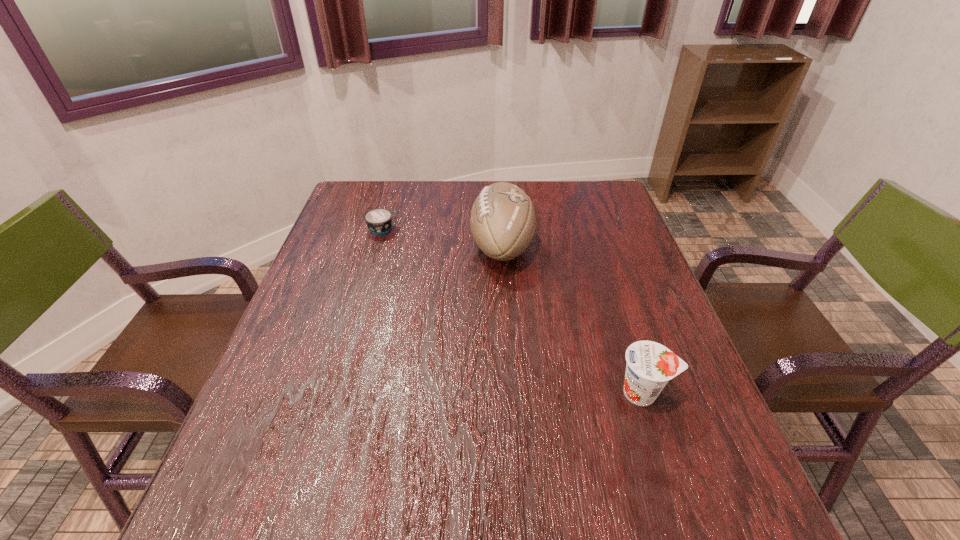
This screenshot has width=960, height=540. Find the location of `free point between the nearer yogurt and the second object from right to left`. free point between the nearer yogurt and the second object from right to left is located at coordinates (572, 320).

Where is `object identified as the closest to the rightmost object`? This screenshot has width=960, height=540. object identified as the closest to the rightmost object is located at coordinates (502, 220).

Find the location of a particular element. This screenshot has width=960, height=540. object that is the closest to the tallest object is located at coordinates (379, 220).

You are a GUI agent. You are given a task and a screenshot of the screen. Output one action in this format:
    pyautogui.click(x=<x>, y=<y>)
    Task: Click on the free spot that satisfies the following two spatial constraints: 1. on the laces of the football (American); 2. on the right side of the nearest object
    Image resolution: width=960 pixels, height=540 pixels.
    Given the screenshot: What is the action you would take?
    pyautogui.click(x=511, y=393)

In order to click on vacant area in the image that satisfies the following two spatial constraints: 1. on the laces of the football (American); 2. on the right side of the nearest object in this screenshot , I will do `click(511, 393)`.

Where is `vacant space that satisfies the following two spatial constraints: 1. on the laces of the football (American); 2. on the right side of the nearest object`? vacant space that satisfies the following two spatial constraints: 1. on the laces of the football (American); 2. on the right side of the nearest object is located at coordinates (511, 393).

Identify the location of vacant area in the image that satisfies the following two spatial constraints: 1. on the back side of the rightmost object; 2. on the laces of the football (American). (595, 246).

Where is `free space that satisfies the following two spatial constraints: 1. on the laces of the football (American); 2. on the right side of the nearer yogurt`? The image size is (960, 540). free space that satisfies the following two spatial constraints: 1. on the laces of the football (American); 2. on the right side of the nearer yogurt is located at coordinates (511, 393).

The height and width of the screenshot is (540, 960). In order to click on vacant space that satisfies the following two spatial constraints: 1. on the laces of the second object from left to right; 2. on the right side of the nearest object in this screenshot , I will do `click(511, 393)`.

You are a GUI agent. You are given a task and a screenshot of the screen. Output one action in this format:
    pyautogui.click(x=<x>, y=<y>)
    Task: Click on the free spot that satisfies the following two spatial constraints: 1. on the laces of the right yogurt; 2. on the right side of the tallest object
    
    Given the screenshot: What is the action you would take?
    pyautogui.click(x=511, y=393)